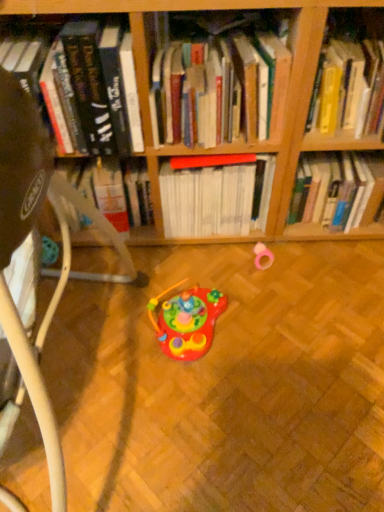
The height and width of the screenshot is (512, 384). I want to click on free location to the right of pink rubber ring at center right, the second toy ordered from the bottom, so tap(314, 262).